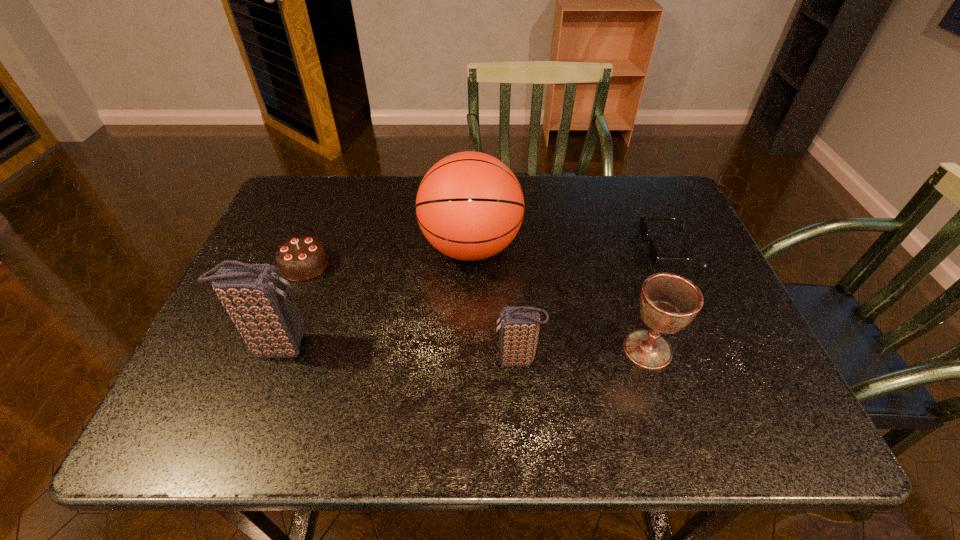
Locate an element on the screen. The height and width of the screenshot is (540, 960). chocolate cake present at the left edge is located at coordinates (301, 258).

Locate an element on the screen. object that is at the right edge is located at coordinates (652, 252).

This screenshot has width=960, height=540. What are the coordinates of `object present at the near left corner` in the screenshot? It's located at (256, 296).

This screenshot has height=540, width=960. In the image, there is a desktop. In order to click on free space at the far edge in this screenshot , I will do tap(577, 180).

This screenshot has height=540, width=960. What are the coordinates of `blank space at the near edge of the desktop` in the screenshot? It's located at (453, 380).

In the image, there is a desktop. In order to click on vacant area at the right edge in this screenshot , I will do `click(705, 282)`.

Where is `vacant space at the far left corner of the desktop`? This screenshot has width=960, height=540. vacant space at the far left corner of the desktop is located at coordinates (287, 217).

Find the location of a particular element. This screenshot has height=540, width=960. vacant space at the near left corner of the desktop is located at coordinates (231, 377).

The width and height of the screenshot is (960, 540). I want to click on free space at the far right corner, so point(661,224).

Identify the location of vacant area that lies between the left clutch bag and the basketball. (374, 296).